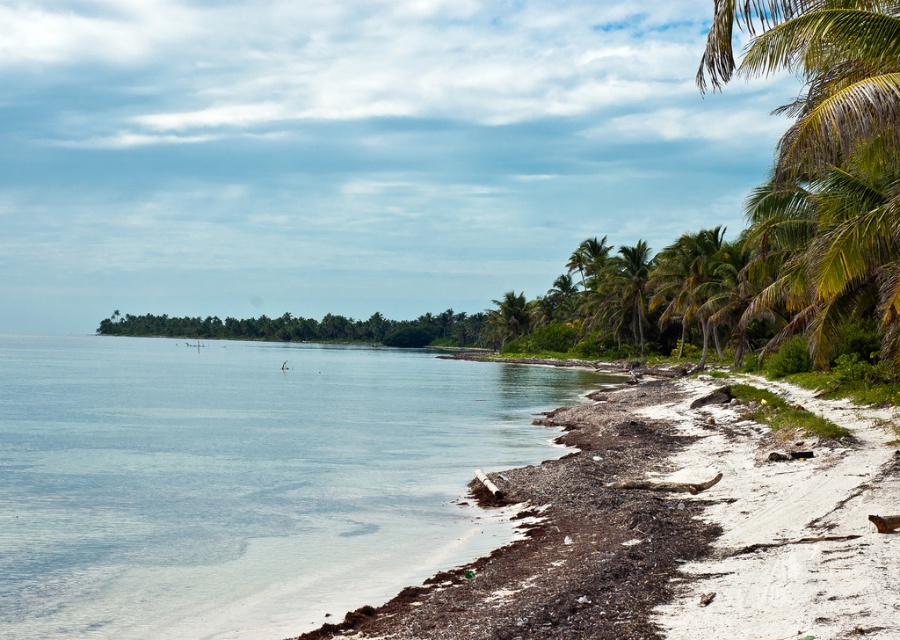
Question: Does clear blue water at lower left appear on the left side of green leafy palm tree at right?

Choices:
 (A) yes
 (B) no

Answer: (A)

Question: Which point appears closest to the camera in this image?

Choices:
 (A) coord(608,284)
 (B) coord(538,560)
 (C) coord(448,516)
 (D) coord(670,288)

Answer: (B)

Question: Which point appears farthest from the camera in this image?

Choices:
 (A) (196, 636)
 (B) (633, 273)
 (C) (685, 241)

Answer: (B)

Question: Which point is closer to the camera?

Choices:
 (A) green leafy palm tree at center-right
 (B) green leafy palm tree at right
 (C) green leafy palm tree at upper right

Answer: (C)

Question: Is clear blue water at lower left closer to the viewer compared to green leafy palm tree at center-right?

Choices:
 (A) yes
 (B) no

Answer: (A)

Question: Can you confirm if clear blue water at lower left is positioned below green leafy palm tree at upper right?

Choices:
 (A) yes
 (B) no

Answer: (A)